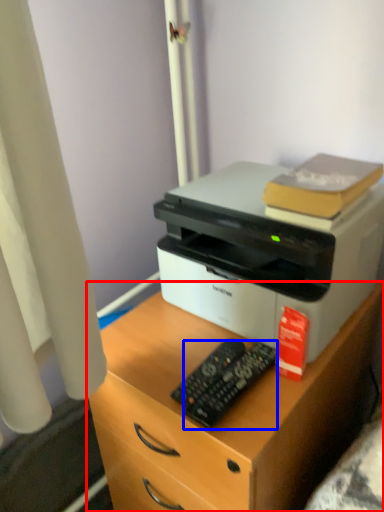
Question: Among these objects, which one is farthest to the camera, desk (highlighted by a red box) or control (highlighted by a blue box)?

Choices:
 (A) desk
 (B) control

Answer: (B)